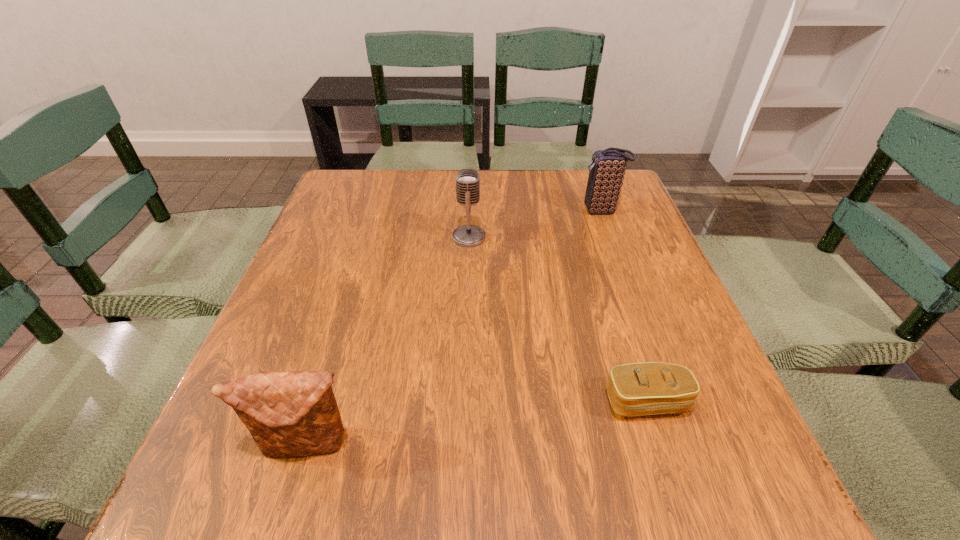
Where is `free spot between the second nearest clutch bag and the farthest clutch bag`? Image resolution: width=960 pixels, height=540 pixels. free spot between the second nearest clutch bag and the farthest clutch bag is located at coordinates [624, 306].

Identify the location of free space between the leftmost clutch bag and the shortest clutch bag. Image resolution: width=960 pixels, height=540 pixels. (477, 423).

Find the location of a particular element. This screenshot has height=540, width=960. object identified as the closest to the second nearest object is located at coordinates (289, 413).

This screenshot has height=540, width=960. What are the coordinates of `object that stands as the third closest to the nearest clutch bag` in the screenshot? It's located at (606, 174).

The height and width of the screenshot is (540, 960). I want to click on clutch bag that stands as the second closest to the farthest object, so click(289, 413).

Where is `the third closest clutch bag to the third object from right to left`? This screenshot has width=960, height=540. the third closest clutch bag to the third object from right to left is located at coordinates (289, 413).

Image resolution: width=960 pixels, height=540 pixels. In order to click on vacant position in the image that satisfies the following two spatial constraints: 1. with the zip open on the farthest clutch bag; 2. on the open side of the leftmost clutch bag in this screenshot , I will do `click(687, 444)`.

The height and width of the screenshot is (540, 960). Identify the location of vacant space that satisfies the following two spatial constraints: 1. with the zip open on the farthest object; 2. on the front side of the third object from right to left. (612, 237).

Identify the location of free space that satisfies the following two spatial constraints: 1. with the zip open on the farthest clutch bag; 2. on the zipper side of the shortest clutch bag. (671, 401).